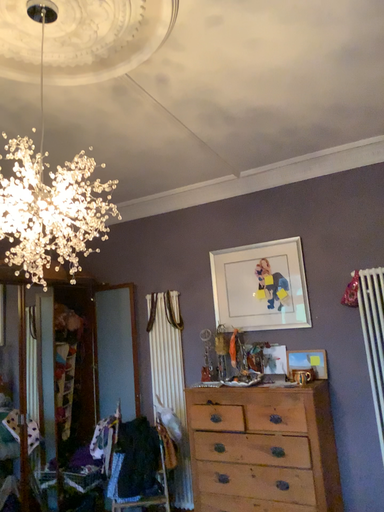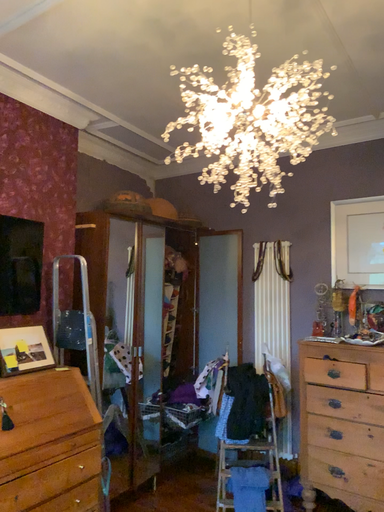
Question: Which way did the camera rotate in the video?

Choices:
 (A) rotated left
 (B) rotated right

Answer: (A)